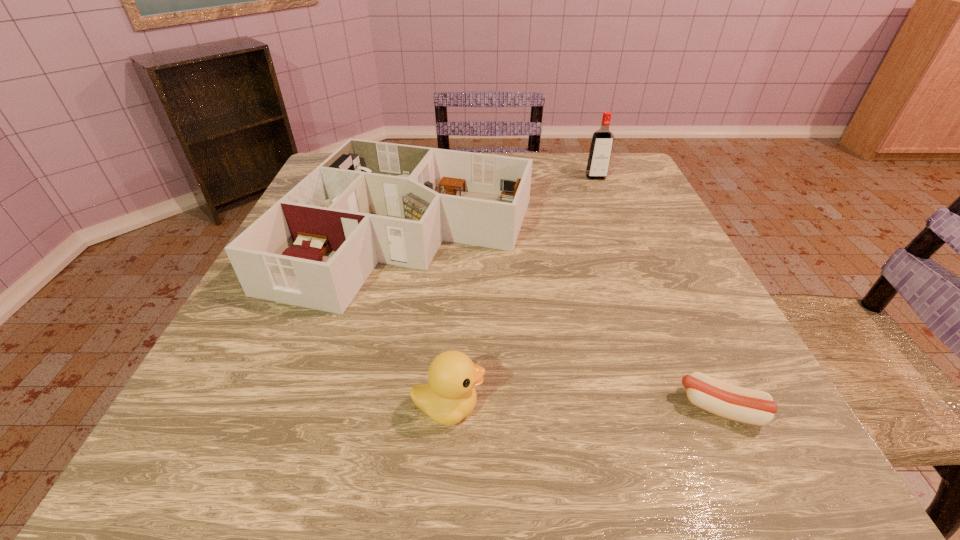
The width and height of the screenshot is (960, 540). What are the coordinates of `duck present at the near edge` in the screenshot? It's located at (449, 396).

Where is `sausage that is at the near edge`? sausage that is at the near edge is located at coordinates (741, 404).

The height and width of the screenshot is (540, 960). In order to click on object present at the left edge in this screenshot , I will do [369, 202].

This screenshot has height=540, width=960. What are the coordinates of `vodka present at the right edge` in the screenshot? It's located at (601, 146).

Locate an element on the screen. This screenshot has height=540, width=960. sausage positioned at the right edge is located at coordinates (741, 404).

The height and width of the screenshot is (540, 960). I want to click on object that is at the far left corner, so click(x=369, y=202).

The image size is (960, 540). I want to click on object located at the far right corner, so click(x=601, y=146).

This screenshot has width=960, height=540. What are the coordinates of `object that is at the near right corner` in the screenshot? It's located at (741, 404).

The width and height of the screenshot is (960, 540). In the image, there is a desktop. Find the location of `free region at the far edge`. free region at the far edge is located at coordinates (549, 163).

You are a GUI agent. You are given a task and a screenshot of the screen. Output one action in this format:
    pyautogui.click(x=<x>, y=<y>)
    Task: Click on the vacant space at the near edge
    The width and height of the screenshot is (960, 540).
    Given the screenshot: What is the action you would take?
    pyautogui.click(x=673, y=472)